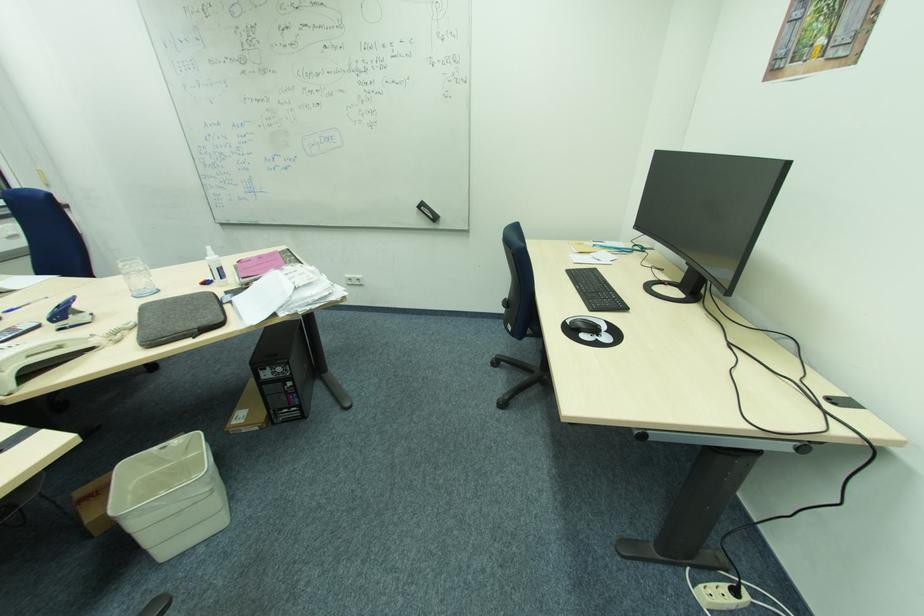
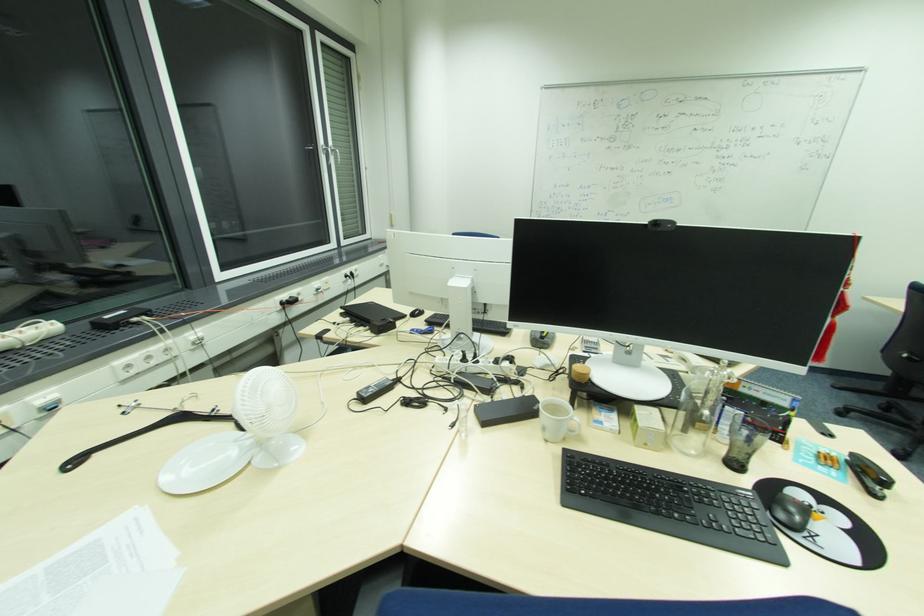
Question: In a continuous first-person perspective shot, in which direction is the camera moving?

Choices:
 (A) Left
 (B) Right
 (C) Forward
 (D) Backward

Answer: (A)